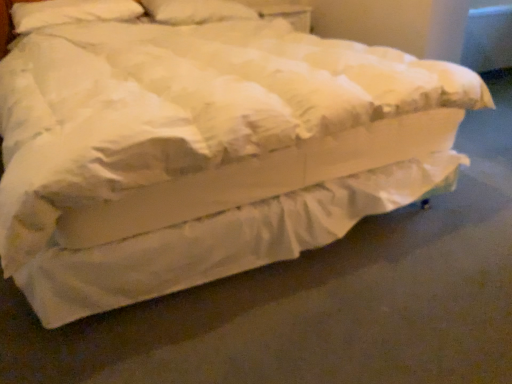
Question: Which direction should I rotate to face white soft pillow at upper center, acting as the second pillow starting from the left, — up or down?

Choices:
 (A) down
 (B) up

Answer: (B)

Question: Can you confirm if white soft pillow at upper center, acting as the second pillow starting from the left, is shorter than white soft pillow at upper left, the second pillow viewed from the right?

Choices:
 (A) yes
 (B) no

Answer: (B)

Question: Does white soft pillow at upper center, acting as the second pillow starting from the left, turn towards white soft pillow at upper left, arranged as the first pillow when viewed from the left?

Choices:
 (A) yes
 (B) no

Answer: (B)

Question: From a real-world perspective, is white soft pillow at upper center, the first pillow from the right, below white soft pillow at upper left, the second pillow viewed from the right?

Choices:
 (A) yes
 (B) no

Answer: (A)

Question: From a real-world perspective, is white soft pillow at upper center, the first pillow from the right, physically above white soft pillow at upper left, arranged as the first pillow when viewed from the left?

Choices:
 (A) no
 (B) yes

Answer: (A)

Question: Is white soft pillow at upper center, acting as the second pillow starting from the left, at the right side of white soft pillow at upper left, the second pillow viewed from the right?

Choices:
 (A) yes
 (B) no

Answer: (A)

Question: Are white soft pillow at upper center, acting as the second pillow starting from the left, and white soft pillow at upper left, the second pillow viewed from the right, located far from each other?

Choices:
 (A) yes
 (B) no

Answer: (B)

Question: Can we say white soft pillow at upper left, arranged as the first pillow when viewed from the left, lies outside white soft pillow at upper center, the first pillow from the right?

Choices:
 (A) yes
 (B) no

Answer: (A)

Question: Is white soft pillow at upper left, arranged as the first pillow when viewed from the left, at the right side of white soft pillow at upper center, acting as the second pillow starting from the left?

Choices:
 (A) yes
 (B) no

Answer: (B)

Question: Considering the relative positions of white soft pillow at upper left, the second pillow viewed from the right, and white soft pillow at upper center, acting as the second pillow starting from the left, in the image provided, is white soft pillow at upper left, the second pillow viewed from the right, in front of white soft pillow at upper center, acting as the second pillow starting from the left,?

Choices:
 (A) yes
 (B) no

Answer: (A)

Question: Can you confirm if white soft pillow at upper left, the second pillow viewed from the right, is thinner than white soft pillow at upper center, the first pillow from the right?

Choices:
 (A) yes
 (B) no

Answer: (A)

Question: Considering the relative sizes of white soft pillow at upper left, arranged as the first pillow when viewed from the left, and white soft pillow at upper center, acting as the second pillow starting from the left, in the image provided, is white soft pillow at upper left, arranged as the first pillow when viewed from the left, wider than white soft pillow at upper center, acting as the second pillow starting from the left,?

Choices:
 (A) yes
 (B) no

Answer: (B)

Question: Is white soft pillow at upper left, arranged as the first pillow when viewed from the left, in contact with white soft pillow at upper center, the first pillow from the right?

Choices:
 (A) no
 (B) yes

Answer: (A)

Question: Does point (143, 0) appear closer or farther from the camera than point (89, 9)?

Choices:
 (A) farther
 (B) closer

Answer: (A)